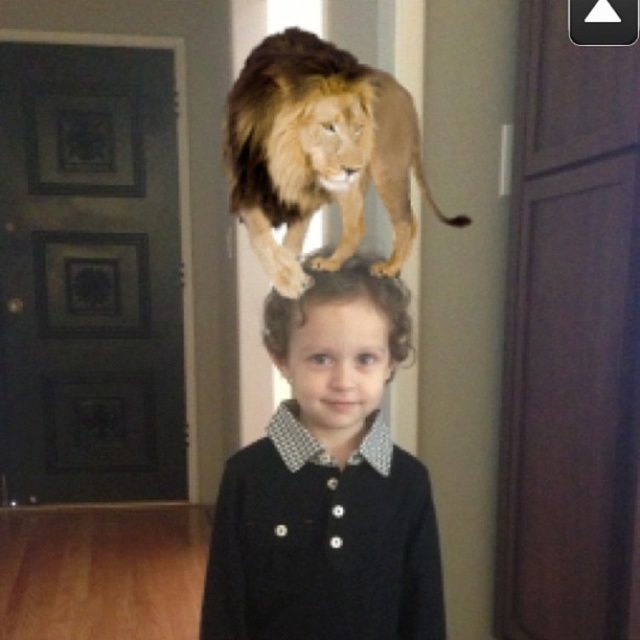
You are a photographer holding a camera and want to take a picture of the black matte dress at center. The camera requires a minimum distance of 30 inches to focus properly. Can you take the photo without moving the dress?

The black matte dress at center and camera are 31.45 inches apart from each other. Since 31.45 inches is greater than the minimum required 30 inches, you can take the photo without moving the dress.

You are a photographer trying to capture the perfect shot of the golden fur lion at center and the matte black hair at center. Based on their positions, which object should you focus on first to ensure both are in frame?

The golden fur lion at center is above matte black hair at center, so you should focus on the golden fur lion at center first to ensure both are in frame.